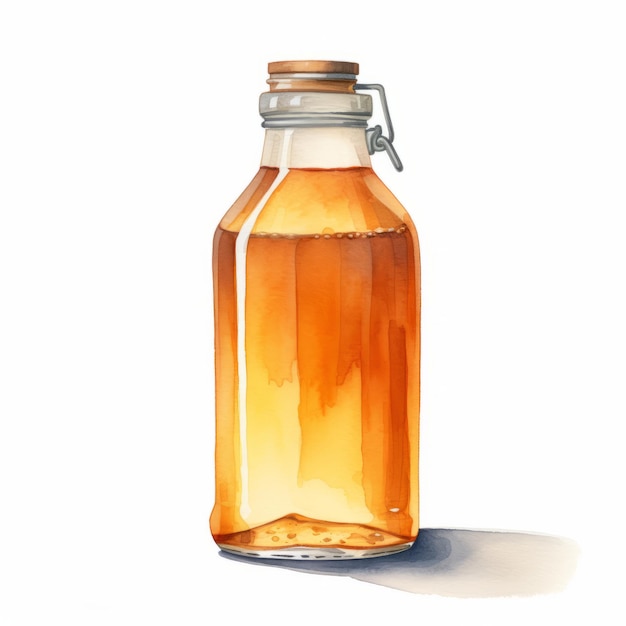
Where is `foam`? foam is located at coordinates 300,151.